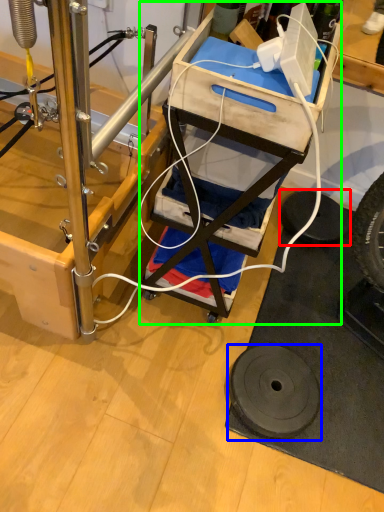
Question: Estimate the real-world distances between objects in this image. Which object is closer to tire (highlighted by a red box), wheel (highlighted by a blue box) or furniture (highlighted by a green box)?

Choices:
 (A) wheel
 (B) furniture

Answer: (A)